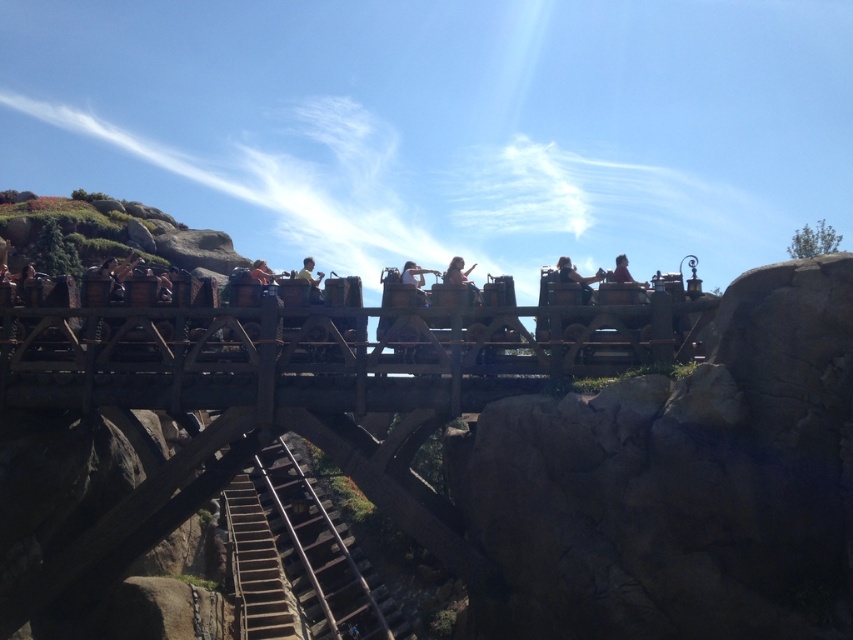
You are a safety inspector checking the roller coaster structure. You notice the rustic wood roller coaster at center and wooden at center. Which one is located above the other?

The rustic wood roller coaster at center is positioned over wooden at center, so the rustic wood roller coaster at center is above the wooden at center.

You are a park designer planning to install a new bench in the amusement park. You want to place it near the roller coaster track so visitors can watch the ride. The current bench is located at light brown wooden bench at center. Where should you place the new bench to ensure it is directly opposite the existing one along the roller coaster track?

To place the new bench directly opposite the light brown wooden bench at center along the roller coaster track, you should position it at the point that is mirrored across the track. Since the existing bench is at coordinates point (577,278), the new bench should be placed at the corresponding mirrored coordinates along the track direction.

You are a guest at the amusement park and want to board the roller coaster. You notice the wooden stairs at center and the matte brown hair at center. Which object is taller?

The matte brown hair at center is taller than the wooden stairs at center.